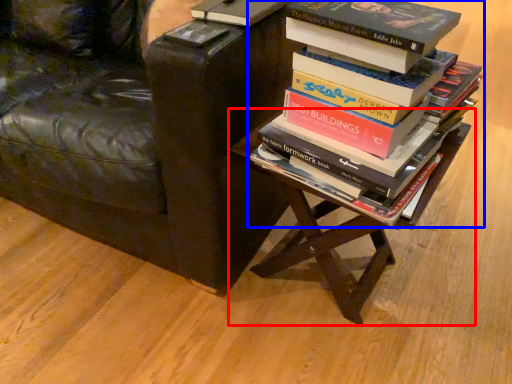
Question: Among these objects, which one is nearest to the camera, table (highlighted by a red box) or book (highlighted by a blue box)?

Choices:
 (A) table
 (B) book

Answer: (B)